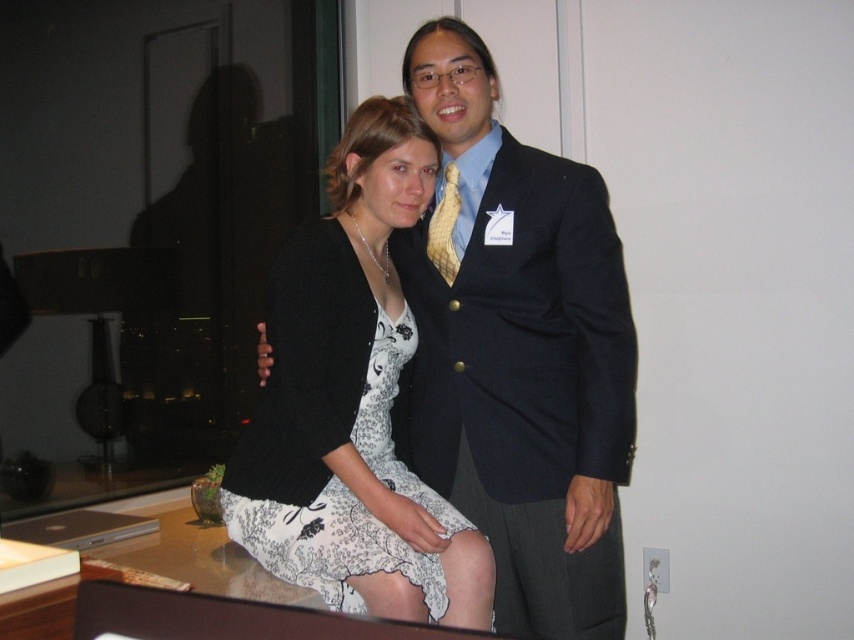
Question: Considering the real-world distances, which object is closest to the white floral dress at center?

Choices:
 (A) navy blue suit at center
 (B) yellow woven tie at center

Answer: (A)

Question: Is navy blue suit at center to the left of white floral dress at center from the viewer's perspective?

Choices:
 (A) no
 (B) yes

Answer: (A)

Question: Which of the following is the closest to the observer?

Choices:
 (A) white floral dress at center
 (B) yellow woven tie at center
 (C) navy blue suit at center

Answer: (A)

Question: Where is navy blue suit at center located in relation to white floral dress at center in the image?

Choices:
 (A) below
 (B) above

Answer: (A)

Question: Which point is closer to the camera?

Choices:
 (A) (588, 374)
 (B) (383, 244)
 (C) (448, 230)

Answer: (A)

Question: Considering the relative positions of white floral dress at center and yellow woven tie at center in the image provided, where is white floral dress at center located with respect to yellow woven tie at center?

Choices:
 (A) above
 (B) below

Answer: (B)